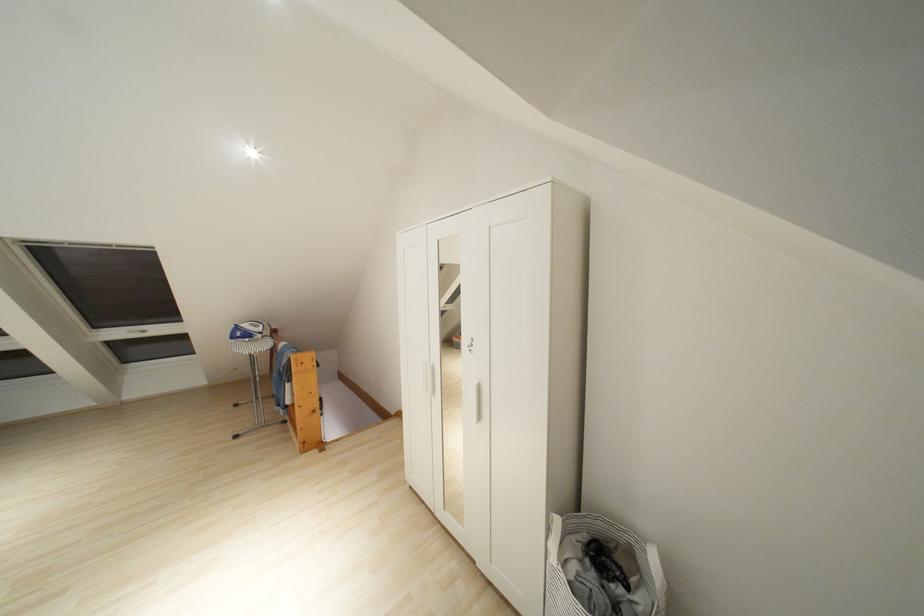
Identify the location of striped laundry basket. Image resolution: width=924 pixels, height=616 pixels. (600, 570).